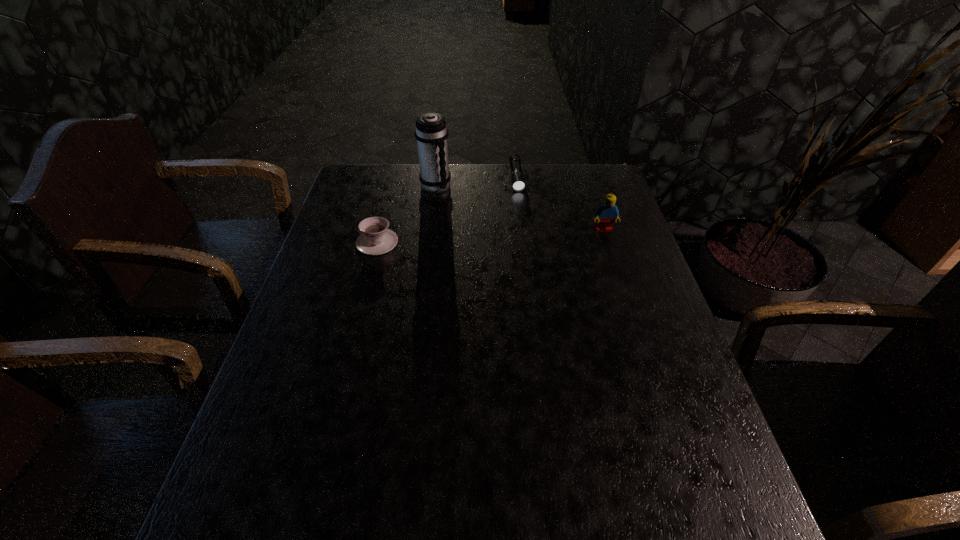
At what (x,y) coordinates should I click in order to perform the action: click on free space on the desktop that is between the second shortest object and the rightmost object and is positioned on the side with the handle of the tallest object. Please return your answer as a coordinate pair (x, y). The height and width of the screenshot is (540, 960). Looking at the image, I should click on (506, 235).

This screenshot has width=960, height=540. In order to click on free space on the desktop that is between the teacup and the rightmost object and is positioned at the lens end of the third object from left to right in this screenshot , I will do `click(525, 234)`.